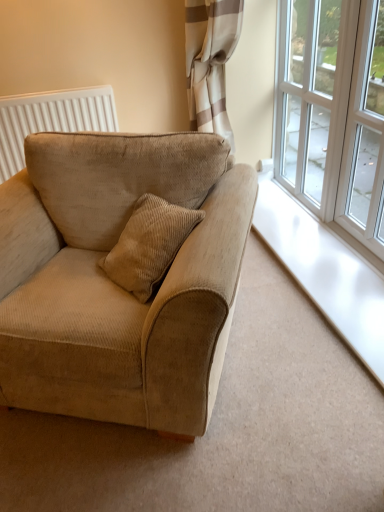
The image size is (384, 512). What do you see at coordinates (365, 136) in the screenshot?
I see `clear glass window at upper right, which is counted as the 2th window, starting from the back` at bounding box center [365, 136].

This screenshot has height=512, width=384. What do you see at coordinates (51, 120) in the screenshot?
I see `white textured radiator at upper left` at bounding box center [51, 120].

Locate an element on the screen. beige corduroy couch at left is located at coordinates (116, 285).

What do you see at coordinates (333, 112) in the screenshot? The height and width of the screenshot is (512, 384). I see `white glass window at upper right, which is the second window from front to back` at bounding box center [333, 112].

How much space does white glass window at upper right, which ranks as the 1th window in back-to-front order, occupy vertically?

The height of white glass window at upper right, which ranks as the 1th window in back-to-front order, is 1.22 meters.

Locate an element on the screen. clear glass window at upper right, which is the 1th window in front-to-back order is located at coordinates (365, 136).

From a real-world perspective, is white textured radiator at upper left over beige corduroy couch at left?

Correct, in the physical world, white textured radiator at upper left is higher than beige corduroy couch at left.

How far apart are white textured radiator at upper left and beige corduroy couch at left?

The distance of white textured radiator at upper left from beige corduroy couch at left is 4.86 feet.

Considering the sizes of objects white textured radiator at upper left and beige corduroy couch at left in the image provided, who is smaller, white textured radiator at upper left or beige corduroy couch at left?

Smaller between the two is white textured radiator at upper left.

Based on the photo, which object is thinner, white textured radiator at upper left or beige corduroy couch at left?

Thinner between the two is white textured radiator at upper left.

Which point is more forward, (376, 205) or (345, 42)?

The point (345, 42) is closer to the camera.

Which of these two, clear glass window at upper right, which is counted as the 2th window, starting from the back, or white glass window at upper right, which ranks as the 1th window in back-to-front order, is wider?

clear glass window at upper right, which is counted as the 2th window, starting from the back, is wider.

Between clear glass window at upper right, which is the 1th window in front-to-back order, and white glass window at upper right, which ranks as the 1th window in back-to-front order, which one has smaller size?

With smaller size is clear glass window at upper right, which is the 1th window in front-to-back order.

Could you tell me if clear glass window at upper right, which is the 1th window in front-to-back order, is facing white glass window at upper right, which is the second window from front to back?

No, clear glass window at upper right, which is the 1th window in front-to-back order, is not oriented towards white glass window at upper right, which is the second window from front to back.

Considering their positions, is beige corduroy couch at left located in front of or behind white glass window at upper right, which is the second window from front to back?

beige corduroy couch at left is in front of white glass window at upper right, which is the second window from front to back.

Looking at this image, which is closer, (153, 413) or (282, 3)?

Point (153, 413) is closer to the camera than point (282, 3).

Who is smaller, beige corduroy couch at left or white glass window at upper right, which ranks as the 1th window in back-to-front order?

white glass window at upper right, which ranks as the 1th window in back-to-front order, is smaller.

Which object is thinner, beige corduroy couch at left or white glass window at upper right, which is the second window from front to back?

Thinner between the two is white glass window at upper right, which is the second window from front to back.

Which of these two, clear glass window at upper right, which is the 1th window in front-to-back order, or beige corduroy couch at left, stands taller?

With more height is clear glass window at upper right, which is the 1th window in front-to-back order.

Does clear glass window at upper right, which is counted as the 2th window, starting from the back, turn towards beige corduroy couch at left?

Yes, clear glass window at upper right, which is counted as the 2th window, starting from the back, is turned towards beige corduroy couch at left.

Image resolution: width=384 pixels, height=512 pixels. I want to click on studio couch in front of the clear glass window at upper right, which is the 1th window in front-to-back order, so click(x=116, y=285).

Is point (106, 245) positioned after point (371, 224)?

No, (106, 245) is closer to viewer.

Is beige corduroy couch at left bigger or smaller than clear glass window at upper right, which is the 1th window in front-to-back order?

Considering their sizes, beige corduroy couch at left takes up more space than clear glass window at upper right, which is the 1th window in front-to-back order.

Is beige corduroy couch at left far from clear glass window at upper right, which is counted as the 2th window, starting from the back?

beige corduroy couch at left is far away from clear glass window at upper right, which is counted as the 2th window, starting from the back.

Between point (359, 216) and point (3, 162), which one is positioned behind?

The point (3, 162) is farther from the camera.

Can white textured radiator at upper left be found inside white glass window at upper right, which ranks as the 1th window in back-to-front order?

No.

From the image's perspective, is white glass window at upper right, which is the second window from front to back, over white textured radiator at upper left?

Yes, from the image's perspective, white glass window at upper right, which is the second window from front to back, is on top of white textured radiator at upper left.

How much distance is there between white glass window at upper right, which is the second window from front to back, and beige corduroy couch at left?

They are 4.59 feet apart.

Is the surface of white glass window at upper right, which is the second window from front to back, in direct contact with beige corduroy couch at left?

They are not placed beside each other.

Which object is positioned more to the right, white glass window at upper right, which is the second window from front to back, or beige corduroy couch at left?

From the viewer's perspective, white glass window at upper right, which is the second window from front to back, appears more on the right side.

Is white glass window at upper right, which ranks as the 1th window in back-to-front order, inside or outside of beige corduroy couch at left?

white glass window at upper right, which ranks as the 1th window in back-to-front order, is spatially situated outside beige corduroy couch at left.

Find the location of a particular element. Image resolution: width=384 pixels, height=512 pixels. studio couch lying below the white textured radiator at upper left (from the image's perspective) is located at coordinates (116, 285).

Identify the location of window lying in front of the white glass window at upper right, which is the second window from front to back. (365, 136).

Considering their positions, is beige corduroy couch at left positioned further to white glass window at upper right, which is the second window from front to back, than clear glass window at upper right, which is the 1th window in front-to-back order?

Among the two, beige corduroy couch at left is located further to white glass window at upper right, which is the second window from front to back.

Based on their spatial positions, is white glass window at upper right, which is the second window from front to back, or beige corduroy couch at left further from white textured radiator at upper left?

white glass window at upper right, which is the second window from front to back, is further to white textured radiator at upper left.

From the image, which object appears to be farther from white glass window at upper right, which ranks as the 1th window in back-to-front order, clear glass window at upper right, which is the 1th window in front-to-back order, or white textured radiator at upper left?

white textured radiator at upper left is positioned further to the anchor white glass window at upper right, which ranks as the 1th window in back-to-front order.

In the scene shown: Which object lies nearer to the anchor point white glass window at upper right, which ranks as the 1th window in back-to-front order, clear glass window at upper right, which is counted as the 2th window, starting from the back, or beige corduroy couch at left?

Based on the image, clear glass window at upper right, which is counted as the 2th window, starting from the back, appears to be nearer to white glass window at upper right, which ranks as the 1th window in back-to-front order.

Which object lies further to the anchor point clear glass window at upper right, which is counted as the 2th window, starting from the back, white glass window at upper right, which is the second window from front to back, or white textured radiator at upper left?

white textured radiator at upper left is further to clear glass window at upper right, which is counted as the 2th window, starting from the back.

From the image, which object appears to be farther from white textured radiator at upper left, clear glass window at upper right, which is counted as the 2th window, starting from the back, or white glass window at upper right, which ranks as the 1th window in back-to-front order?

clear glass window at upper right, which is counted as the 2th window, starting from the back, lies further to white textured radiator at upper left than the other object.

Looking at the image, which one is located closer to beige corduroy couch at left, white glass window at upper right, which is the second window from front to back, or clear glass window at upper right, which is the 1th window in front-to-back order?

Among the two, clear glass window at upper right, which is the 1th window in front-to-back order, is located nearer to beige corduroy couch at left.

From the image, which object appears to be nearer to white textured radiator at upper left, clear glass window at upper right, which is the 1th window in front-to-back order, or beige corduroy couch at left?

Based on the image, beige corduroy couch at left appears to be nearer to white textured radiator at upper left.

This screenshot has width=384, height=512. In order to click on window situated between white textured radiator at upper left and clear glass window at upper right, which is counted as the 2th window, starting from the back, from left to right in this screenshot , I will do `click(333, 112)`.

I want to click on window between beige corduroy couch at left and clear glass window at upper right, which is counted as the 2th window, starting from the back, in the horizontal direction, so click(x=333, y=112).

This screenshot has height=512, width=384. What are the coordinates of `studio couch between white textured radiator at upper left and clear glass window at upper right, which is the 1th window in front-to-back order, from left to right` in the screenshot? It's located at (116, 285).